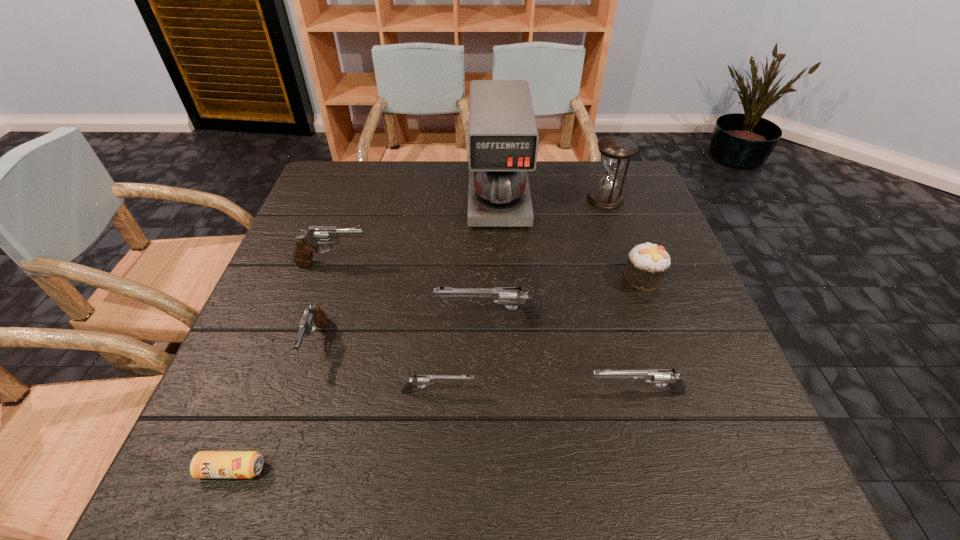
Identify the location of the shortest pistol. (424, 380).

The height and width of the screenshot is (540, 960). I want to click on beer can, so click(x=205, y=464).

In order to click on the shortest object in this screenshot , I will do `click(205, 464)`.

Where is `vacant space located 0.120m on the carafe side of the coffee maker`? Image resolution: width=960 pixels, height=540 pixels. vacant space located 0.120m on the carafe side of the coffee maker is located at coordinates pos(502,261).

Locate an element on the screen. The height and width of the screenshot is (540, 960). free space located 0.170m on the left of the eighth shortest object is located at coordinates (527, 199).

This screenshot has width=960, height=540. Identify the location of vacant point located 0.150m at the barrel of the seventh shortest object. (432, 264).

The image size is (960, 540). What are the coordinates of `vacant area situated 0.090m on the front of the cupcake` in the screenshot? It's located at (660, 323).

You are a GUI agent. You are given a task and a screenshot of the screen. Output one action in this format:
    pyautogui.click(x=<x>, y=<y>)
    Task: Click on the vacant area situated 0.300m on the front-facing side of the biggest silver pistol
    The image size is (960, 540).
    Given the screenshot: What is the action you would take?
    click(x=297, y=317)

Find the location of a particular element. vacant space situated on the front-facing side of the biggest silver pistol is located at coordinates (297, 317).

The height and width of the screenshot is (540, 960). In order to click on free location located 0.270m on the front-facing side of the biggest silver pistol in this screenshot , I will do `click(310, 317)`.